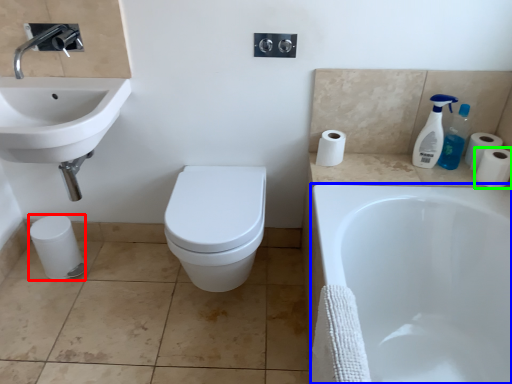
Question: Considering the real-world distances, which object is closest to toilet paper (highlighted by a red box)? bathtub (highlighted by a blue box) or toilet paper (highlighted by a green box).

Choices:
 (A) bathtub
 (B) toilet paper

Answer: (A)